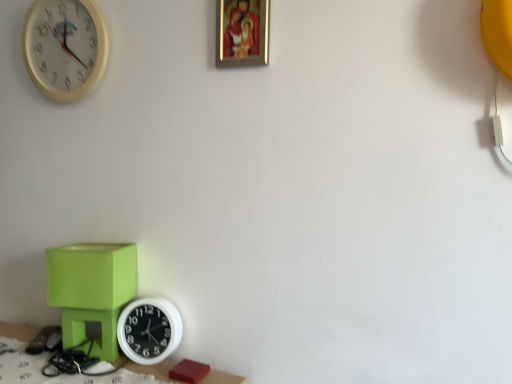
Question: Can you confirm if matte green table at lower left is thinner than white plastic wall clock at upper left, acting as the 1th wall clock starting from the top?

Choices:
 (A) no
 (B) yes

Answer: (A)

Question: Considering the relative positions of matte green table at lower left and white plastic wall clock at upper left, marked as the second wall clock in a bottom-to-top arrangement, in the image provided, is matte green table at lower left behind white plastic wall clock at upper left, marked as the second wall clock in a bottom-to-top arrangement,?

Choices:
 (A) yes
 (B) no

Answer: (B)

Question: Is matte green table at lower left in front of white plastic wall clock at upper left, acting as the 1th wall clock starting from the top?

Choices:
 (A) yes
 (B) no

Answer: (A)

Question: From a real-world perspective, is matte green table at lower left located beneath white plastic wall clock at upper left, acting as the 1th wall clock starting from the top?

Choices:
 (A) no
 (B) yes

Answer: (B)

Question: From the image's perspective, does matte green table at lower left appear higher than white plastic wall clock at upper left, marked as the second wall clock in a bottom-to-top arrangement?

Choices:
 (A) no
 (B) yes

Answer: (A)

Question: Can you confirm if matte green table at lower left is shorter than white plastic wall clock at upper left, acting as the 1th wall clock starting from the top?

Choices:
 (A) no
 (B) yes

Answer: (B)

Question: Considering the relative sizes of matte green table at lower left and matte green cube at lower left in the image provided, is matte green table at lower left shorter than matte green cube at lower left?

Choices:
 (A) no
 (B) yes

Answer: (B)

Question: Is matte green table at lower left with matte green cube at lower left?

Choices:
 (A) no
 (B) yes

Answer: (A)

Question: From a real-world perspective, is matte green table at lower left positioned over matte green cube at lower left based on gravity?

Choices:
 (A) yes
 (B) no

Answer: (B)

Question: Does matte green table at lower left appear on the right side of matte green cube at lower left?

Choices:
 (A) no
 (B) yes

Answer: (A)

Question: Is matte green table at lower left aimed at matte green cube at lower left?

Choices:
 (A) yes
 (B) no

Answer: (B)

Question: Considering the relative sizes of matte green table at lower left and matte green cube at lower left in the image provided, is matte green table at lower left smaller than matte green cube at lower left?

Choices:
 (A) yes
 (B) no

Answer: (A)

Question: Is white plastic wall clock at lower left, which is counted as the 2th wall clock, starting from the left, positioned with its back to matte green cube at lower left?

Choices:
 (A) no
 (B) yes

Answer: (A)